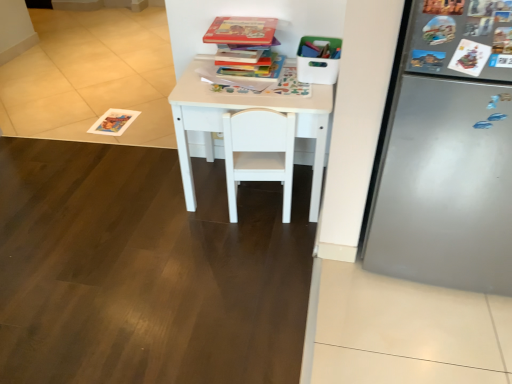
Find the location of a particular element. vacant area on top of hardcover book at upper center, the 1th book positioned from the top (from a real-world perspective) is located at coordinates click(x=242, y=28).